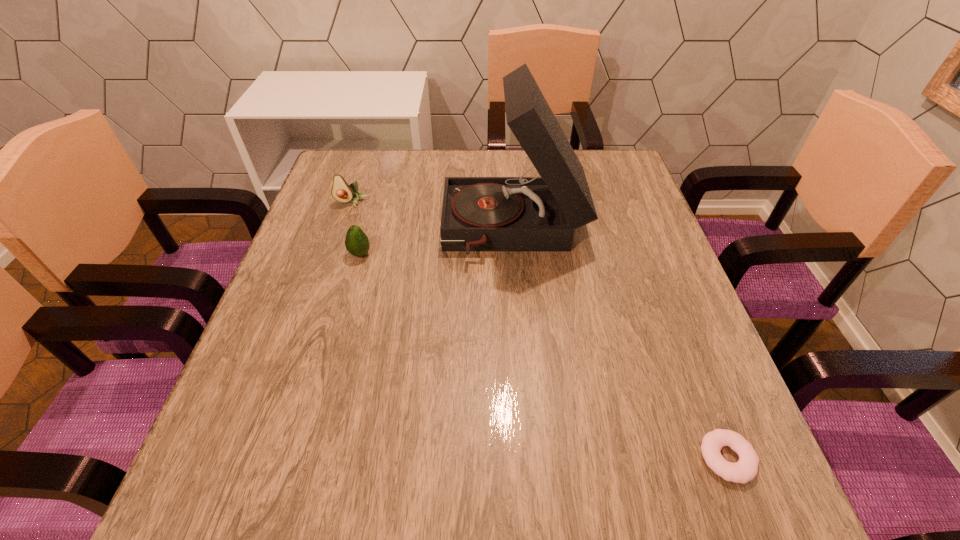
You are a GUI agent. You are given a task and a screenshot of the screen. Output one action in this format:
    pyautogui.click(x=<x>, y=<y>)
    Task: Click on the free space located on the seed side of the farther avocado
    
    Given the screenshot: What is the action you would take?
    pyautogui.click(x=320, y=297)

This screenshot has width=960, height=540. In order to click on free spot located on the right of the third tallest object in this screenshot , I will do `click(496, 254)`.

What are the coordinates of `free spot located 0.100m on the left of the nearest object` in the screenshot? It's located at (637, 458).

This screenshot has width=960, height=540. Identify the location of object that is at the near edge. (746, 469).

Find the location of a particular element. object at the right edge is located at coordinates (746, 469).

At what (x,y) coordinates should I click in order to perform the action: click on object positioned at the near right corner. Please return your answer as a coordinate pair (x, y). Looking at the image, I should click on (746, 469).

You are a GUI agent. You are given a task and a screenshot of the screen. Output one action in this format:
    pyautogui.click(x=<x>, y=<y>)
    Task: Click on the vacant space at the far edge
    
    Given the screenshot: What is the action you would take?
    pyautogui.click(x=419, y=177)

In the image, there is a desktop. Identify the location of vacant area at the near edge. This screenshot has width=960, height=540. (403, 526).

In the image, there is a desktop. Identify the location of vacant space at the left edge. This screenshot has width=960, height=540. (261, 405).

Find the location of `vacant space at the right edge`. vacant space at the right edge is located at coordinates (671, 350).